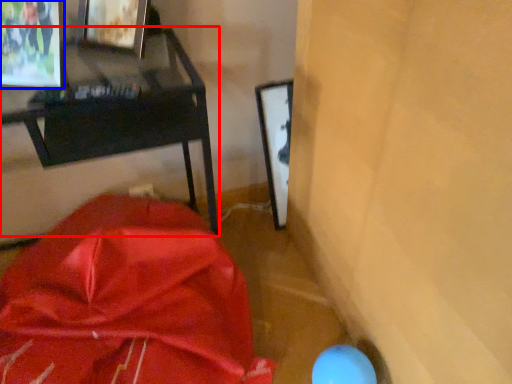
Question: Which object appears farthest to the camera in this image, furniture (highlighted by a red box) or picture frame (highlighted by a blue box)?

Choices:
 (A) furniture
 (B) picture frame

Answer: (B)